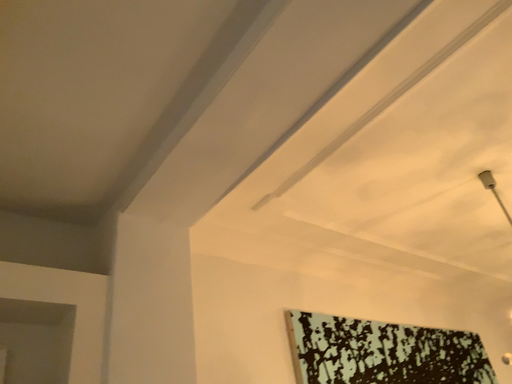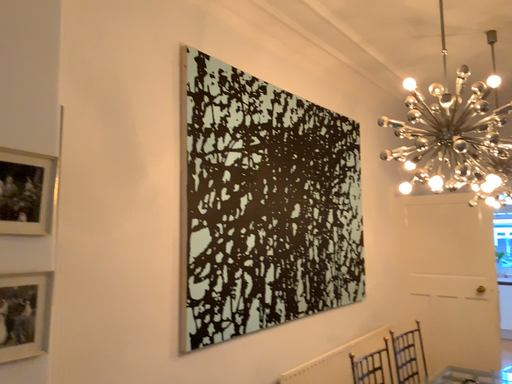
Question: Which way did the camera rotate in the video?

Choices:
 (A) rotated upward
 (B) rotated downward

Answer: (B)